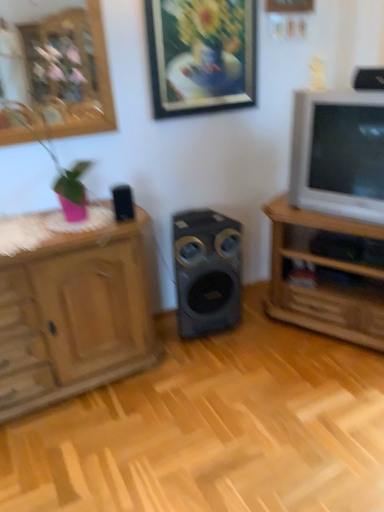
You are a GUI agent. You are given a task and a screenshot of the screen. Output one action in this format:
    pyautogui.click(x=<x>, y=<y>)
    Task: Click on the vacant space to the right of matte black speaker at center, which appears as the 3th speaker when viewed from the front
    Image resolution: width=384 pixels, height=512 pixels.
    Given the screenshot: What is the action you would take?
    pyautogui.click(x=263, y=325)